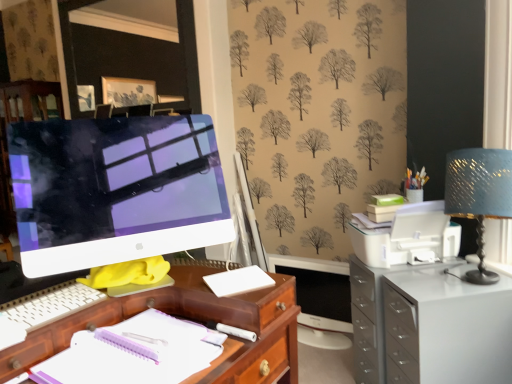
I want to click on free spot to the left of blue textured lampshade at upper right, so click(426, 289).